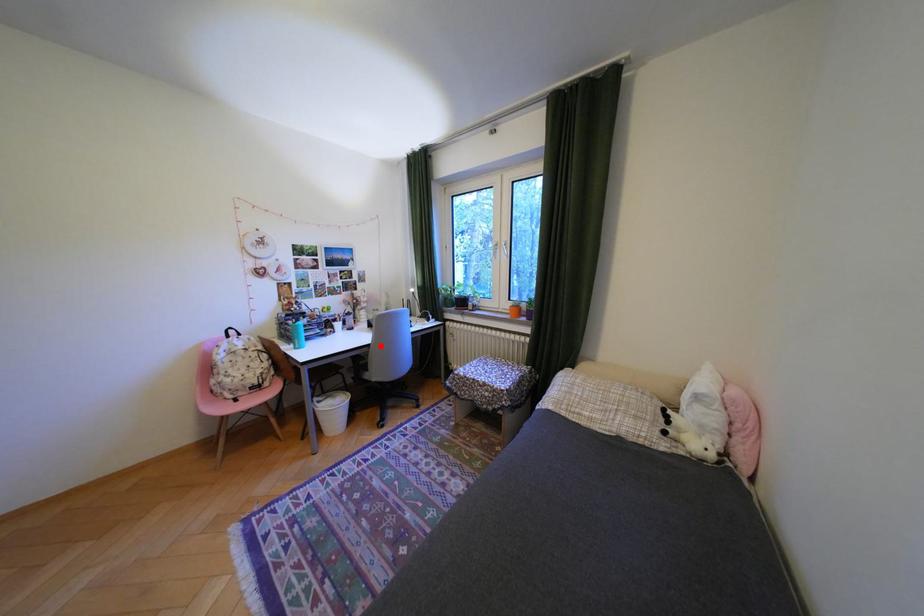
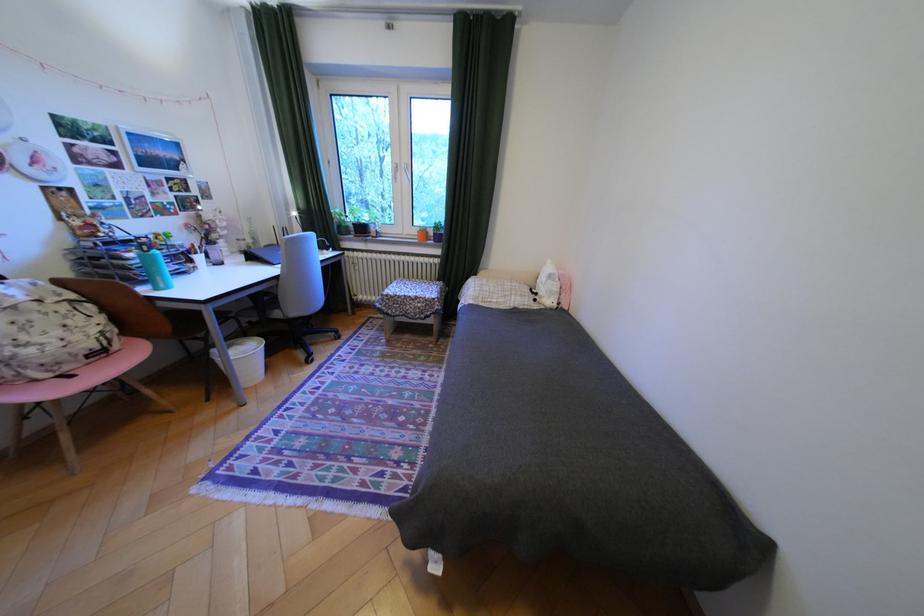
The point at the highlighted location is marked in the first image. Where is the corresponding point in the second image?

(288, 278)